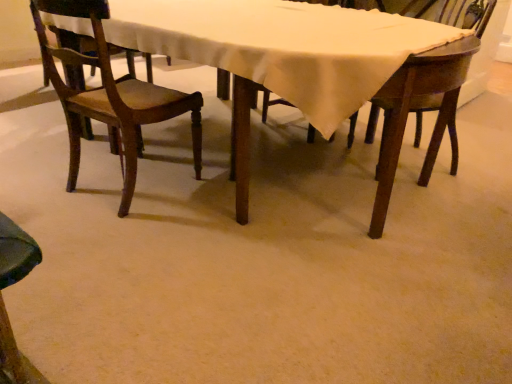
Question: Is wooden chair at upper right, positioned as the 2th chair in left-to-right order, closer to the viewer compared to wooden chair at left, which is counted as the first chair, starting from the left?

Choices:
 (A) yes
 (B) no

Answer: (B)

Question: From a real-world perspective, does wooden chair at upper right, placed as the first chair when sorted from right to left, sit lower than wooden chair at left, which is counted as the first chair, starting from the left?

Choices:
 (A) yes
 (B) no

Answer: (B)

Question: Does wooden chair at upper right, positioned as the 2th chair in left-to-right order, have a smaller size compared to wooden chair at left, the 2th chair from the right?

Choices:
 (A) no
 (B) yes

Answer: (B)

Question: Is wooden chair at upper right, placed as the first chair when sorted from right to left, oriented away from wooden chair at left, which is counted as the first chair, starting from the left?

Choices:
 (A) no
 (B) yes

Answer: (A)

Question: Is wooden chair at upper right, placed as the first chair when sorted from right to left, to the left of wooden chair at left, which is counted as the first chair, starting from the left, from the viewer's perspective?

Choices:
 (A) no
 (B) yes

Answer: (A)

Question: Considering the positions of wooden chair at upper right, positioned as the 2th chair in left-to-right order, and wooden table at center in the image, is wooden chair at upper right, positioned as the 2th chair in left-to-right order, taller or shorter than wooden table at center?

Choices:
 (A) short
 (B) tall

Answer: (B)

Question: Would you say wooden chair at upper right, positioned as the 2th chair in left-to-right order, is inside or outside wooden table at center?

Choices:
 (A) inside
 (B) outside

Answer: (A)

Question: Considering their positions, is wooden chair at upper right, placed as the first chair when sorted from right to left, located in front of or behind wooden table at center?

Choices:
 (A) front
 (B) behind

Answer: (B)

Question: In terms of size, does wooden chair at upper right, positioned as the 2th chair in left-to-right order, appear bigger or smaller than wooden table at center?

Choices:
 (A) big
 (B) small

Answer: (B)

Question: Is wooden chair at left, the 2th chair from the right, wider or thinner than wooden chair at upper right, positioned as the 2th chair in left-to-right order?

Choices:
 (A) wide
 (B) thin

Answer: (A)

Question: Is wooden chair at left, the 2th chair from the right, taller or shorter than wooden chair at upper right, positioned as the 2th chair in left-to-right order?

Choices:
 (A) short
 (B) tall

Answer: (A)

Question: From the image's perspective, relative to wooden chair at upper right, positioned as the 2th chair in left-to-right order, is wooden chair at left, which is counted as the first chair, starting from the left, above or below?

Choices:
 (A) below
 (B) above

Answer: (A)

Question: Based on their sizes in the image, would you say wooden chair at left, which is counted as the first chair, starting from the left, is bigger or smaller than wooden chair at upper right, positioned as the 2th chair in left-to-right order?

Choices:
 (A) big
 (B) small

Answer: (A)

Question: In terms of width, does wooden table at center look wider or thinner when compared to wooden chair at upper right, placed as the first chair when sorted from right to left?

Choices:
 (A) thin
 (B) wide

Answer: (B)

Question: From a real-world perspective, relative to wooden chair at upper right, placed as the first chair when sorted from right to left, is wooden table at center vertically above or below?

Choices:
 (A) above
 (B) below

Answer: (B)